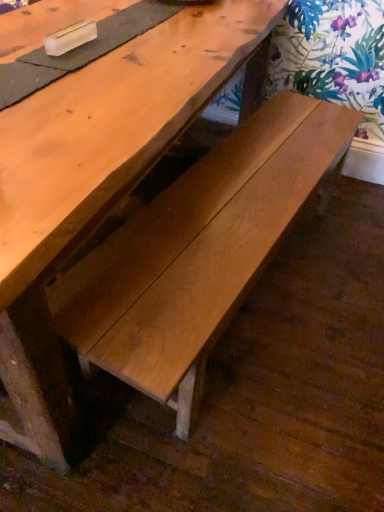
Question: Should I look upward or downward to see light brown wood bench at center?

Choices:
 (A) up
 (B) down

Answer: (A)